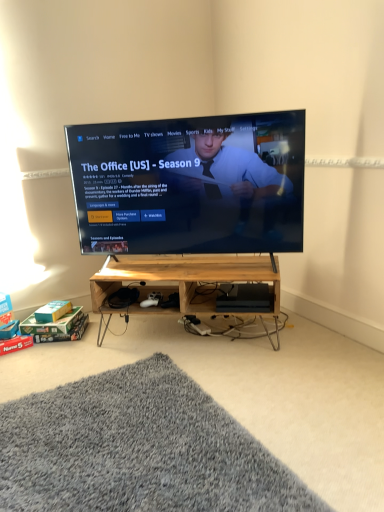
Question: Is matte black tv at center bigger or smaller than wooden at center, positioned as the 2th shelf in bottom-to-top order?

Choices:
 (A) big
 (B) small

Answer: (A)

Question: Is matte black tv at center taller or shorter than wooden at center, the 1th shelf from the top?

Choices:
 (A) short
 (B) tall

Answer: (B)

Question: Based on their relative distances, which object is nearer to the wooden at center, the 1th shelf when ordered from bottom to top?

Choices:
 (A) wooden at center, the 1th shelf from the top
 (B) matte black tv at center
 (C) gray shaggy rug at lower left

Answer: (A)

Question: Considering the real-world distances, which object is closest to the matte black tv at center?

Choices:
 (A) gray shaggy rug at lower left
 (B) wooden at center, the 1th shelf from the top
 (C) wooden at center, placed as the second shelf when sorted from top to bottom

Answer: (C)